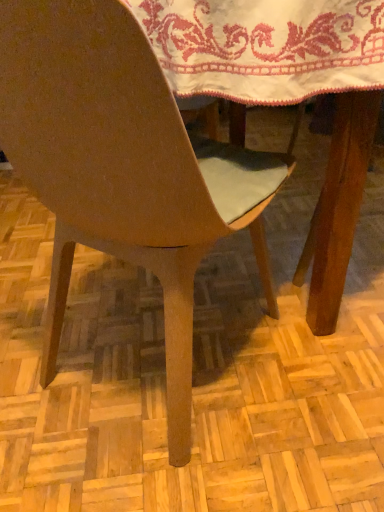
Question: From the image's perspective, relative to matte wood chair at center, is white embroidered cloth at upper center above or below?

Choices:
 (A) below
 (B) above

Answer: (B)

Question: Based on their positions, is white embroidered cloth at upper center located to the left or right of matte wood chair at center?

Choices:
 (A) right
 (B) left

Answer: (A)

Question: Do you think white embroidered cloth at upper center is within matte wood chair at center, or outside of it?

Choices:
 (A) outside
 (B) inside

Answer: (A)

Question: From the image's perspective, is matte wood chair at center above or below white embroidered cloth at upper center?

Choices:
 (A) above
 (B) below

Answer: (B)

Question: Considering their positions, is matte wood chair at center located in front of or behind white embroidered cloth at upper center?

Choices:
 (A) behind
 (B) front

Answer: (B)

Question: From a real-world perspective, is matte wood chair at center above or below white embroidered cloth at upper center?

Choices:
 (A) above
 (B) below

Answer: (B)

Question: In terms of size, does matte wood chair at center appear bigger or smaller than white embroidered cloth at upper center?

Choices:
 (A) big
 (B) small

Answer: (A)